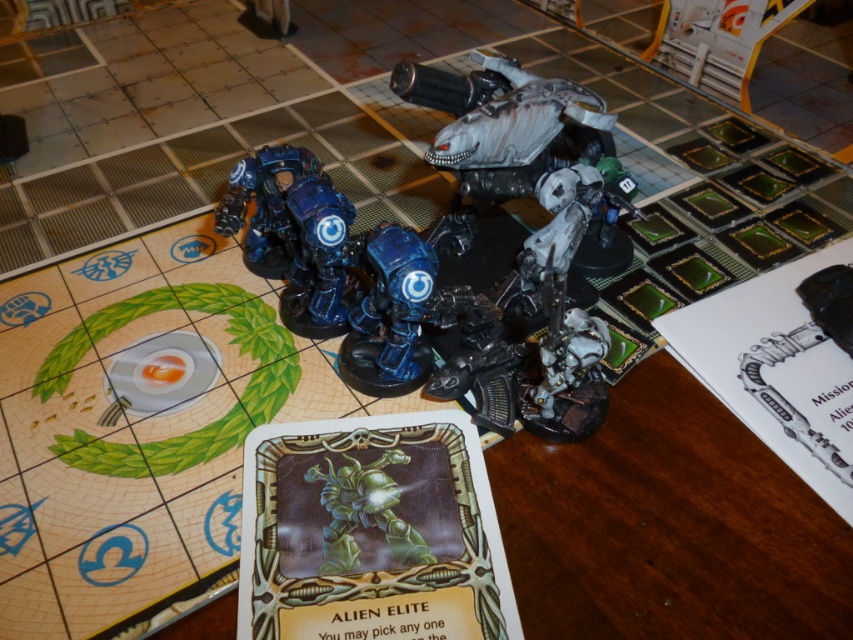
Question: Does blue metallic armor at center have a greater width compared to blue metallic alien elite at center?

Choices:
 (A) no
 (B) yes

Answer: (B)

Question: Is blue metallic armor at center wider than blue metallic alien elite at center?

Choices:
 (A) yes
 (B) no

Answer: (A)

Question: Which object appears farthest from the camera in this image?

Choices:
 (A) blue metallic armor at center
 (B) blue metallic alien elite at center

Answer: (A)

Question: Is blue metallic armor at center above blue metallic alien elite at center?

Choices:
 (A) no
 (B) yes

Answer: (B)

Question: Among these objects, which one is nearest to the camera?

Choices:
 (A) blue metallic alien elite at center
 (B) blue metallic armor at center

Answer: (A)

Question: Which point is farther to the camera?

Choices:
 (A) (398, 298)
 (B) (331, 259)

Answer: (B)